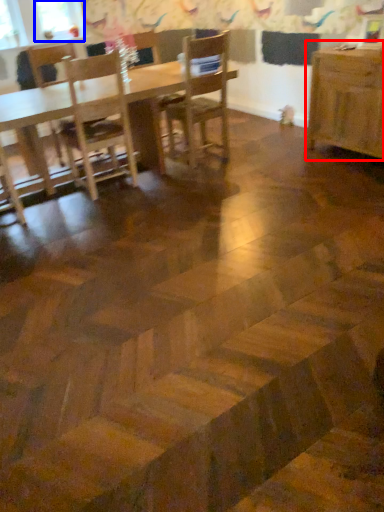
Question: Which object appears farthest to the camera in this image, table (highlighted by a red box) or window screen (highlighted by a blue box)?

Choices:
 (A) table
 (B) window screen

Answer: (B)